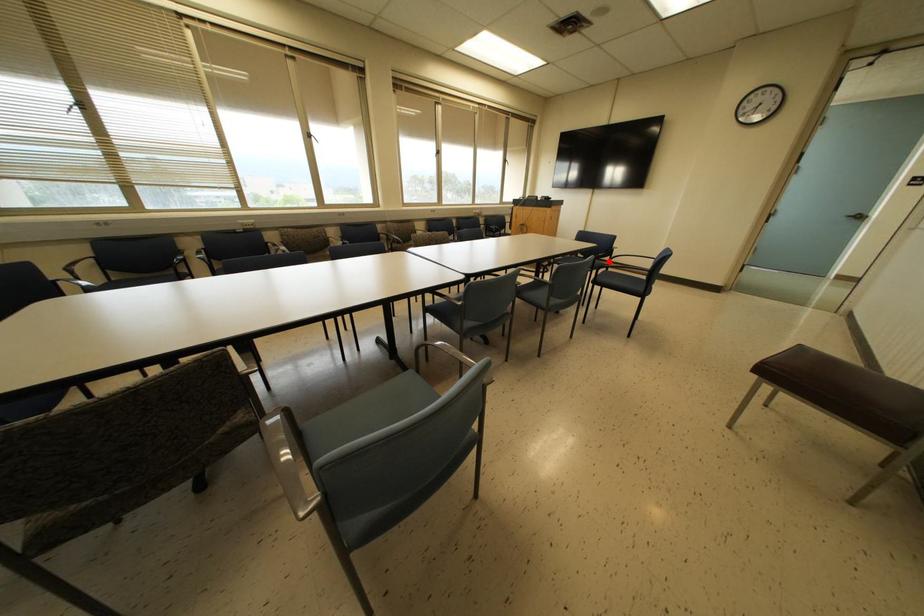
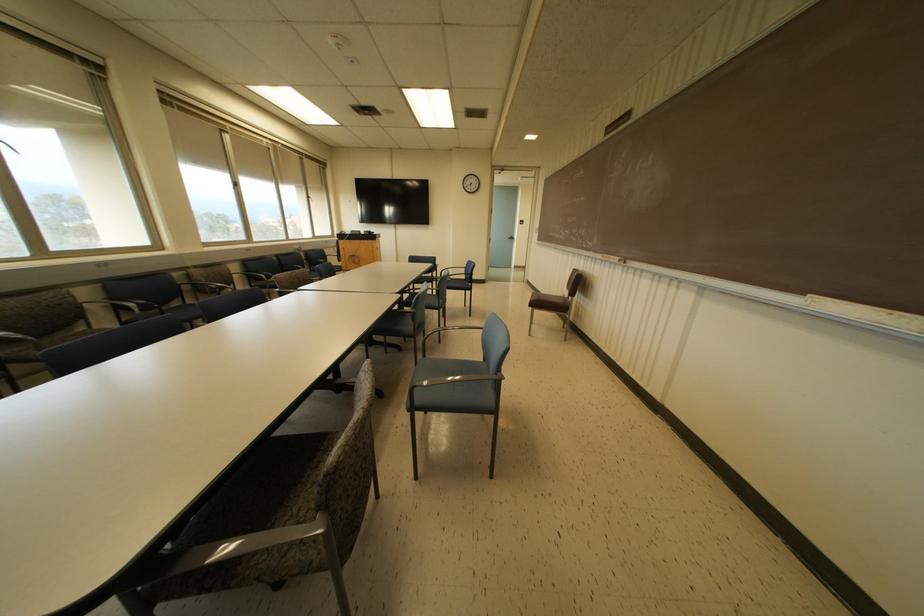
Where in the second image is the point corresponding to the highlighted location from the first image?

(438, 274)